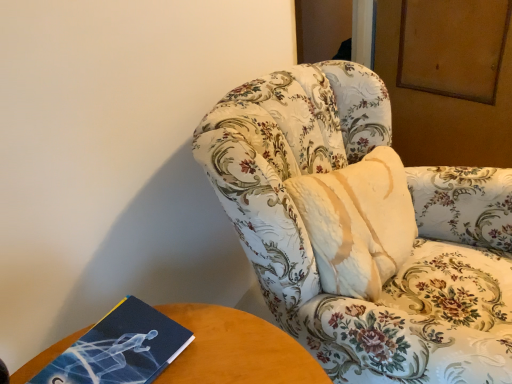
In order to click on vacant space situated above blue matte book at lower left (from a real-world perspective) in this screenshot , I will do `click(106, 350)`.